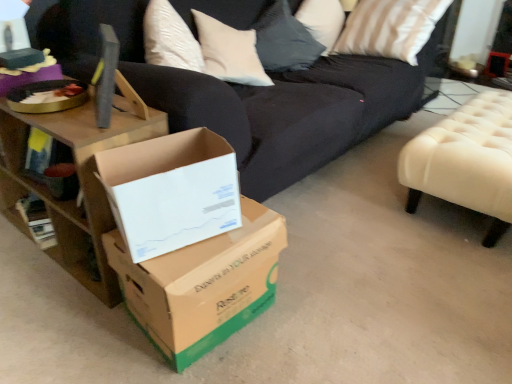
Question: Is white cardboard box at center, placed as the first box when sorted from top to bottom, positioned behind wooden table at left?

Choices:
 (A) no
 (B) yes

Answer: (A)

Question: Would you say white cardboard box at center, placed as the first box when sorted from top to bottom, is outside wooden table at left?

Choices:
 (A) yes
 (B) no

Answer: (A)

Question: Does white cardboard box at center, which is the 2th box in bottom-to-top order, appear on the right side of wooden table at left?

Choices:
 (A) no
 (B) yes

Answer: (B)

Question: Can you confirm if white cardboard box at center, placed as the first box when sorted from top to bottom, is thinner than wooden table at left?

Choices:
 (A) no
 (B) yes

Answer: (B)

Question: Is white cardboard box at center, which is the 2th box in bottom-to-top order, with wooden table at left?

Choices:
 (A) yes
 (B) no

Answer: (B)

Question: From a real-world perspective, relative to metallic silver side table at upper right, is white cardboard box at center, which is the 2th box in bottom-to-top order, vertically above or below?

Choices:
 (A) above
 (B) below

Answer: (A)

Question: From the image's perspective, relative to metallic silver side table at upper right, is white cardboard box at center, which is the 2th box in bottom-to-top order, above or below?

Choices:
 (A) below
 (B) above

Answer: (A)

Question: Does point (199, 182) appear closer or farther from the camera than point (437, 110)?

Choices:
 (A) farther
 (B) closer

Answer: (B)

Question: Visually, is white cardboard box at center, placed as the first box when sorted from top to bottom, positioned to the left or to the right of metallic silver side table at upper right?

Choices:
 (A) right
 (B) left

Answer: (B)

Question: Looking at the image, does white tufted ottoman at right seem bigger or smaller compared to white cardboard box at center, which is the 2th box in bottom-to-top order?

Choices:
 (A) big
 (B) small

Answer: (A)

Question: Is white tufted ottoman at right inside the boundaries of white cardboard box at center, which is the 2th box in bottom-to-top order, or outside?

Choices:
 (A) inside
 (B) outside

Answer: (B)

Question: Considering the positions of point (484, 100) and point (192, 139), is point (484, 100) closer or farther from the camera than point (192, 139)?

Choices:
 (A) farther
 (B) closer

Answer: (A)

Question: Relative to white cardboard box at center, placed as the first box when sorted from top to bottom, is white tufted ottoman at right in front or behind?

Choices:
 (A) front
 (B) behind

Answer: (B)

Question: Considering the positions of brown cardboard box at center, arranged as the 2th box when viewed from the top, and white cardboard box at center, placed as the first box when sorted from top to bottom, in the image, is brown cardboard box at center, arranged as the 2th box when viewed from the top, wider or thinner than white cardboard box at center, placed as the first box when sorted from top to bottom,?

Choices:
 (A) wide
 (B) thin

Answer: (A)

Question: Would you say brown cardboard box at center, which ranks as the first box in bottom-to-top order, is inside or outside white cardboard box at center, which is the 2th box in bottom-to-top order?

Choices:
 (A) inside
 (B) outside

Answer: (B)